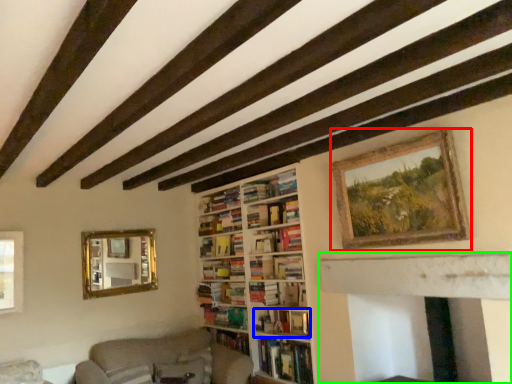
Question: Considering the real-world distances, which object is closest to picture frame (highlighted by a red box)? book (highlighted by a blue box) or fireplace (highlighted by a green box).

Choices:
 (A) book
 (B) fireplace

Answer: (B)